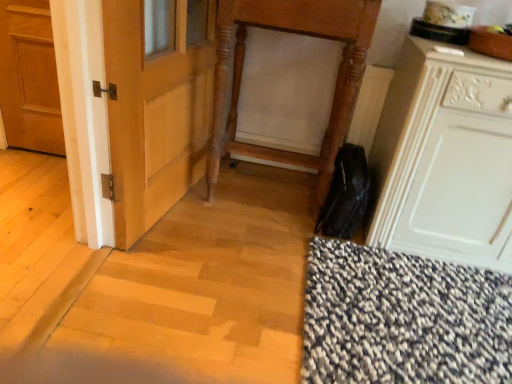
Question: Considering the positions of white matte cabinet at lower right and wooden carved vanity at center in the image, is white matte cabinet at lower right taller or shorter than wooden carved vanity at center?

Choices:
 (A) tall
 (B) short

Answer: (B)

Question: From the image's perspective, is white matte cabinet at lower right located above or below wooden carved vanity at center?

Choices:
 (A) below
 (B) above

Answer: (A)

Question: Which of these objects is positioned closest to the white matte cabinet at lower right?

Choices:
 (A) wooden carved vanity at center
 (B) matte wooden door at left

Answer: (A)

Question: Which object is the closest to the white matte cabinet at lower right?

Choices:
 (A) matte wooden door at left
 (B) wooden carved vanity at center

Answer: (B)